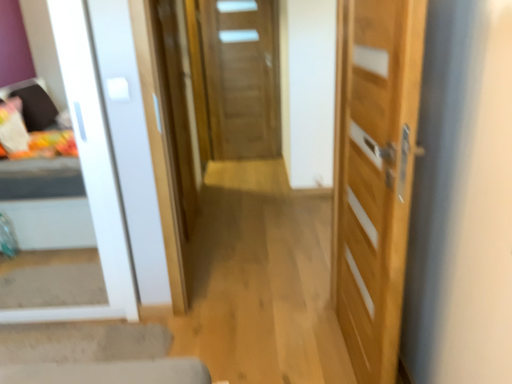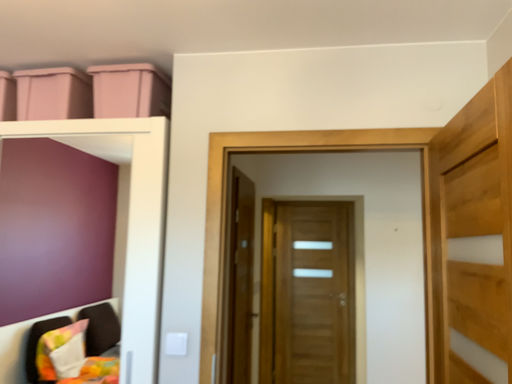
Question: Which way did the camera rotate in the video?

Choices:
 (A) rotated downward
 (B) rotated upward

Answer: (B)